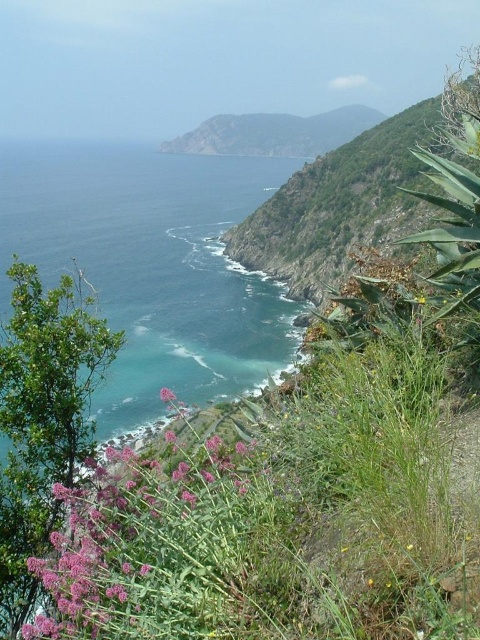
You are a hiker standing at the top of the cliff looking down. You see the blue water at lower left and the purple matte flower at lower left. Which object is higher up the cliff?

The purple matte flower at lower left is higher up the cliff because it is shorter than the blue water at lower left, which is much taller.

You are standing at the point marked by the coordinate point at (152, 266) in the coastal landscape. What do you see directly in front of you?

You see blue water at lower left directly in front of you at the point marked by the coordinate point at (152, 266).

You are standing at a coastal viewpoint and want to know how far the point at coordinates (x=248, y=621) is from your current position. Can you determine the distance?

The distance between the point at coordinates (x=248, y=621) and the viewer is 23.13 feet.